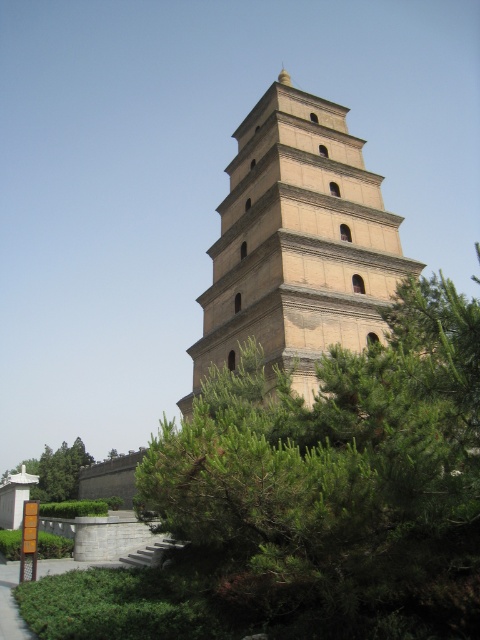
Question: Which point appears closest to the camera in this image?

Choices:
 (A) (187, 400)
 (B) (384, 454)

Answer: (B)

Question: Is green leafy tree at center further to camera compared to green leafy tree at lower left?

Choices:
 (A) no
 (B) yes

Answer: (A)

Question: Is green leafy tree at center positioned behind beige brick tower at center?

Choices:
 (A) yes
 (B) no

Answer: (B)

Question: Which of the following is the closest to the observer?

Choices:
 (A) green leafy tree at center
 (B) beige brick tower at center
 (C) green leafy tree at lower left

Answer: (A)

Question: Which point appears farthest from the camera in this image?

Choices:
 (A) (294, 218)
 (B) (477, 356)
 (C) (43, 499)

Answer: (C)

Question: Is green leafy tree at center positioned at the back of beige brick tower at center?

Choices:
 (A) no
 (B) yes

Answer: (A)